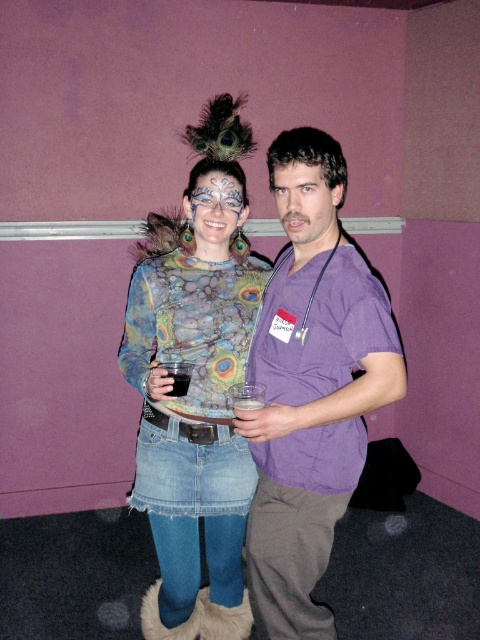
Is smooth skin face at center positioned behind matte peacock feather at center?

No, it is not.

Is smooth skin face at center shorter than matte peacock feather at center?

Yes, smooth skin face at center is shorter than matte peacock feather at center.

Describe the element at coordinates (305, 209) in the screenshot. I see `smooth skin face at center` at that location.

Locate an element on the screen. This screenshot has width=480, height=640. smooth skin face at center is located at coordinates (305, 209).

Does purple scrubs at center have a greater height compared to smooth skin face at center?

Indeed, purple scrubs at center has a greater height compared to smooth skin face at center.

Is purple scrubs at center positioned behind smooth skin face at center?

No, it is not.

Where is `purple scrubs at center`? This screenshot has height=640, width=480. purple scrubs at center is located at coordinates (311, 387).

Does textured peacock feather dress at center appear on the right side of smooth skin face at center?

In fact, textured peacock feather dress at center is to the left of smooth skin face at center.

Measure the distance between point (159, 444) and camera.

Point (159, 444) and camera are 6.02 feet apart.

Who is more distant from viewer, [172,636] or [298,179]?

Point [172,636]

Where is `textured peacock feather dress at center`? Image resolution: width=480 pixels, height=640 pixels. textured peacock feather dress at center is located at coordinates (192, 428).